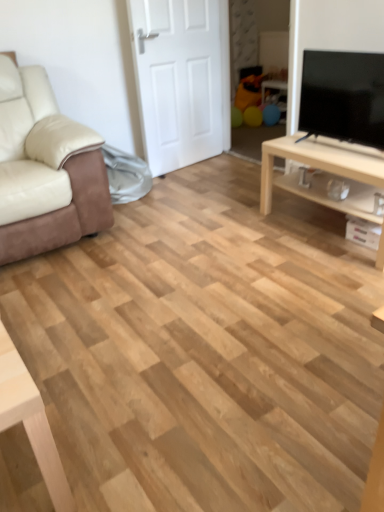
The width and height of the screenshot is (384, 512). In order to click on free space in front of beige leather couch at left in this screenshot , I will do `click(84, 281)`.